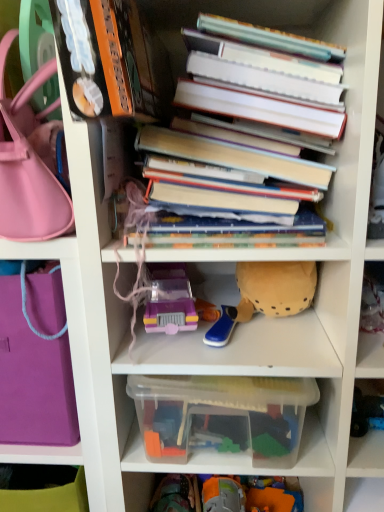
Measure the distance between soft yellow plush at center, acting as the 1th toy starting from the right, and camera.

65.40 centimeters.

In order to face hardcover books at center, should I rotate leftwards or rightwards?

Turn right approximately 5.782 degrees to face it.

The image size is (384, 512). I want to click on clear plastic container at center, so click(222, 418).

Which of these two, matte pink handbag at left, positioned as the 2th handbag in bottom-to-top order, or purple fabric bag at left, which is the first handbag in bottom-to-top order, stands shorter?

With less height is matte pink handbag at left, positioned as the 2th handbag in bottom-to-top order.

In the scene shown: Does matte pink handbag at left, which appears as the first handbag when viewed from the top, have a smaller size compared to purple fabric bag at left, arranged as the second handbag when viewed from the top?

Yes.

Does matte pink handbag at left, which appears as the first handbag when viewed from the top, touch purple fabric bag at left, which is the first handbag in bottom-to-top order?

No, matte pink handbag at left, which appears as the first handbag when viewed from the top, is not beside purple fabric bag at left, which is the first handbag in bottom-to-top order.

Considering the sizes of objects hardcover books at center and matte pink handbag at left, positioned as the 2th handbag in bottom-to-top order, in the image provided, who is shorter, hardcover books at center or matte pink handbag at left, positioned as the 2th handbag in bottom-to-top order,?

matte pink handbag at left, positioned as the 2th handbag in bottom-to-top order.

Which is nearer, (222, 79) or (8, 104)?

Point (8, 104)

Between hardcover books at center and matte pink handbag at left, which appears as the first handbag when viewed from the top, which one appears on the left side from the viewer's perspective?

matte pink handbag at left, which appears as the first handbag when viewed from the top, is more to the left.

Considering the sizes of hardcover books at center and matte pink handbag at left, positioned as the 2th handbag in bottom-to-top order, in the image, is hardcover books at center wider or thinner than matte pink handbag at left, positioned as the 2th handbag in bottom-to-top order,?

hardcover books at center is wider than matte pink handbag at left, positioned as the 2th handbag in bottom-to-top order.

Is matte pink handbag at left, which appears as the first handbag when viewed from the top, to the right of clear plastic container at center from the viewer's perspective?

No.

Considering the relative positions of matte pink handbag at left, positioned as the 2th handbag in bottom-to-top order, and clear plastic container at center in the image provided, is matte pink handbag at left, positioned as the 2th handbag in bottom-to-top order, behind clear plastic container at center?

No, it is not.

Does matte pink handbag at left, which appears as the first handbag when viewed from the top, have a lesser height compared to clear plastic container at center?

In fact, matte pink handbag at left, which appears as the first handbag when viewed from the top, may be taller than clear plastic container at center.

From a real-world perspective, which object stands above the other?

translucent plastic toy car at center, placed as the 1th toy when sorted from left to right.

Could you tell me if translucent plastic toy car at center, positioned as the third toy in right-to-left order, is facing clear plastic container at center?

No, translucent plastic toy car at center, positioned as the third toy in right-to-left order, does not turn towards clear plastic container at center.

This screenshot has width=384, height=512. Find the location of `shelf in front of the translucent plastic toy car at center, placed as the 1th toy when sorted from left to right`. shelf in front of the translucent plastic toy car at center, placed as the 1th toy when sorted from left to right is located at coordinates (222, 418).

Considering the relative sizes of translucent plastic toy car at center, positioned as the third toy in right-to-left order, and clear plastic container at center in the image provided, is translucent plastic toy car at center, positioned as the third toy in right-to-left order, bigger than clear plastic container at center?

No.

Considering the positions of objects translucent plastic toy car at center, positioned as the third toy in right-to-left order, and blue rubber toy at center, the 2th toy in the left-to-right sequence, in the image provided, who is more to the left, translucent plastic toy car at center, positioned as the third toy in right-to-left order, or blue rubber toy at center, the 2th toy in the left-to-right sequence,?

translucent plastic toy car at center, positioned as the third toy in right-to-left order.

From the image's perspective, is translucent plastic toy car at center, positioned as the third toy in right-to-left order, located above or below blue rubber toy at center, the 2th toy in the left-to-right sequence?

Based on their image positions, translucent plastic toy car at center, positioned as the third toy in right-to-left order, is located above blue rubber toy at center, the 2th toy in the left-to-right sequence.

Is point (185, 326) closer or farther from the camera than point (232, 327)?

Point (185, 326) is closer to the camera than point (232, 327).

Do you think translucent plastic toy car at center, positioned as the third toy in right-to-left order, is within blue rubber toy at center, the 2th toy in the left-to-right sequence, or outside of it?

translucent plastic toy car at center, positioned as the third toy in right-to-left order, is located beyond the bounds of blue rubber toy at center, the 2th toy in the left-to-right sequence.

Which object is thinner, purple fabric bag at left, arranged as the second handbag when viewed from the top, or soft yellow plush at center, acting as the 1th toy starting from the right?

With smaller width is soft yellow plush at center, acting as the 1th toy starting from the right.

Find the location of a particular element. the 2nd handbag counting from the left of the soft yellow plush at center, marked as the 3th toy in a left-to-right arrangement is located at coordinates (33, 379).

Is purple fabric bag at left, arranged as the second handbag when viewed from the top, touching soft yellow plush at center, marked as the 3th toy in a left-to-right arrangement?

purple fabric bag at left, arranged as the second handbag when viewed from the top, is not next to soft yellow plush at center, marked as the 3th toy in a left-to-right arrangement, and they're not touching.

Looking at this image, from a real-world perspective, who is located lower, hardcover books at center or clear plastic container at center?

clear plastic container at center.

Could you tell me if hardcover books at center is facing clear plastic container at center?

No.

From the image's perspective, is hardcover books at center located beneath clear plastic container at center?

No, from the image's perspective, hardcover books at center is not below clear plastic container at center.

Would you consider hardcover books at center to be distant from clear plastic container at center?

No, hardcover books at center is in close proximity to clear plastic container at center.

Find the location of a particular element. handbag behind the matte pink handbag at left, positioned as the 2th handbag in bottom-to-top order is located at coordinates (33, 379).

This screenshot has height=512, width=384. What are the coordinates of `book that is above the matte pink handbag at left, which appears as the first handbag when viewed from the top (from the image's perspective)` in the screenshot? It's located at (247, 128).

From the image, which object appears to be nearer to purple fabric bag at left, which is the first handbag in bottom-to-top order, hardcover books at center or matte pink handbag at left, which appears as the first handbag when viewed from the top?

Among the two, matte pink handbag at left, which appears as the first handbag when viewed from the top, is located nearer to purple fabric bag at left, which is the first handbag in bottom-to-top order.

Based on their spatial positions, is blue rubber toy at center, which is counted as the 2th toy, starting from the right, or hardcover books at center closer to translucent plastic toy car at center, positioned as the third toy in right-to-left order?

blue rubber toy at center, which is counted as the 2th toy, starting from the right.

Which object lies nearer to the anchor point purple fabric bag at left, arranged as the second handbag when viewed from the top, translucent plastic toy car at center, placed as the 1th toy when sorted from left to right, or blue rubber toy at center, which is counted as the 2th toy, starting from the right?

The object closer to purple fabric bag at left, arranged as the second handbag when viewed from the top, is translucent plastic toy car at center, placed as the 1th toy when sorted from left to right.

From the picture: Based on their spatial positions, is clear plastic container at center or soft yellow plush at center, marked as the 3th toy in a left-to-right arrangement, further from purple fabric bag at left, arranged as the second handbag when viewed from the top?

soft yellow plush at center, marked as the 3th toy in a left-to-right arrangement, lies further to purple fabric bag at left, arranged as the second handbag when viewed from the top, than the other object.

Estimate the real-world distances between objects in this image. Which object is closer to clear plastic container at center, soft yellow plush at center, marked as the 3th toy in a left-to-right arrangement, or blue rubber toy at center, the 2th toy in the left-to-right sequence?

The object closer to clear plastic container at center is blue rubber toy at center, the 2th toy in the left-to-right sequence.

Based on their spatial positions, is hardcover books at center or clear plastic container at center closer to matte pink handbag at left, which appears as the first handbag when viewed from the top?

Among the two, hardcover books at center is located nearer to matte pink handbag at left, which appears as the first handbag when viewed from the top.

Looking at the image, which one is located closer to translucent plastic toy car at center, placed as the 1th toy when sorted from left to right, blue rubber toy at center, the 2th toy in the left-to-right sequence, or soft yellow plush at center, acting as the 1th toy starting from the right?

Among the two, blue rubber toy at center, the 2th toy in the left-to-right sequence, is located nearer to translucent plastic toy car at center, placed as the 1th toy when sorted from left to right.

Estimate the real-world distances between objects in this image. Which object is closer to clear plastic container at center, blue rubber toy at center, which is counted as the 2th toy, starting from the right, or translucent plastic toy car at center, placed as the 1th toy when sorted from left to right?

Among the two, blue rubber toy at center, which is counted as the 2th toy, starting from the right, is located nearer to clear plastic container at center.

Locate an element on the screen. Image resolution: width=384 pixels, height=512 pixels. handbag between hardcover books at center and blue rubber toy at center, which is counted as the 2th toy, starting from the right, from top to bottom is located at coordinates coord(27,166).

At what (x,y) coordinates should I click in order to perform the action: click on handbag between hardcover books at center and translucent plastic toy car at center, positioned as the third toy in right-to-left order, in the up-down direction. Please return your answer as a coordinate pair (x, y). This screenshot has width=384, height=512. Looking at the image, I should click on (27, 166).

At what (x,y) coordinates should I click in order to perform the action: click on toy between translucent plastic toy car at center, placed as the 1th toy when sorted from left to right, and soft yellow plush at center, acting as the 1th toy starting from the right, from left to right. Please return your answer as a coordinate pair (x, y). Looking at the image, I should click on (222, 327).

Locate an element on the screen. The width and height of the screenshot is (384, 512). book between purple fabric bag at left, which is the first handbag in bottom-to-top order, and soft yellow plush at center, marked as the 3th toy in a left-to-right arrangement, in the horizontal direction is located at coordinates (247, 128).